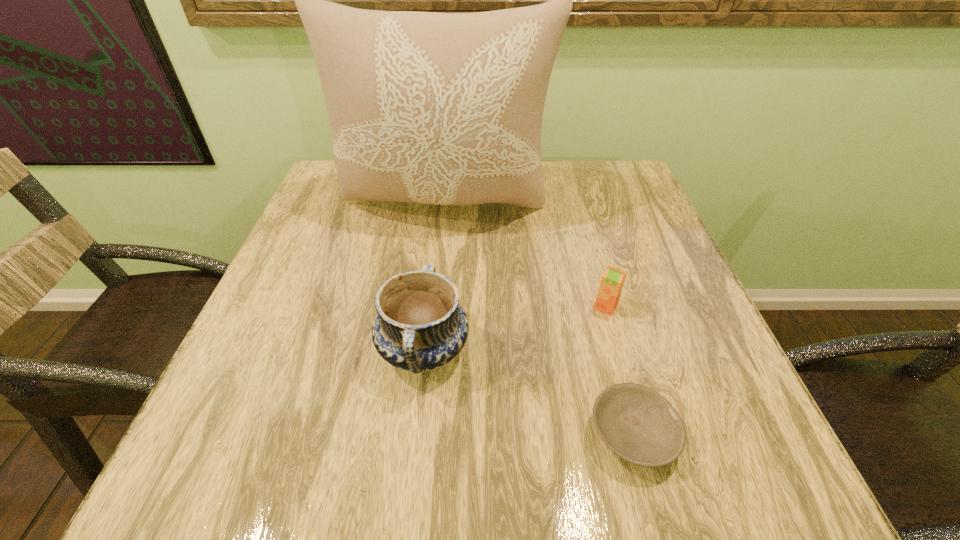
The width and height of the screenshot is (960, 540). I want to click on object that is positioned at the near edge, so click(635, 422).

Find the location of a particular element. This screenshot has height=540, width=960. object positioned at the left edge is located at coordinates (437, 108).

Where is `orange juice situated at the right edge`? orange juice situated at the right edge is located at coordinates (612, 281).

Identify the location of bowl positioned at the right edge. (635, 422).

The height and width of the screenshot is (540, 960). I want to click on object located in the far left corner section of the desktop, so click(437, 108).

Where is `object that is positioned at the near right corner`? The image size is (960, 540). object that is positioned at the near right corner is located at coordinates (635, 422).

The image size is (960, 540). In the image, there is a desktop. Identify the location of vacant space at the far edge. (560, 174).

This screenshot has width=960, height=540. I want to click on free space at the near edge of the desktop, so click(358, 459).

Find the location of `free space at the left edge of the desktop`. free space at the left edge of the desktop is located at coordinates (312, 333).

In the image, there is a desktop. In order to click on free space at the right edge in this screenshot , I will do `click(676, 306)`.